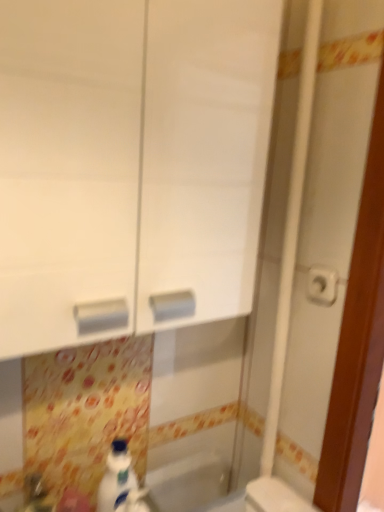
What do you see at coordinates (130, 165) in the screenshot?
I see `white glossy cabinet at center` at bounding box center [130, 165].

Image resolution: width=384 pixels, height=512 pixels. What are the coordinates of `white plastic toilet at lower right` in the screenshot? It's located at (274, 497).

Measure the distance between white glossy bath at lower center and camera.

white glossy bath at lower center is 3.30 feet away from camera.

Describe the element at coordinates (34, 496) in the screenshot. I see `white glossy sink at lower left` at that location.

What do you see at coordinates (322, 285) in the screenshot? I see `white plastic toilet paper at right` at bounding box center [322, 285].

What do you see at coordinates (116, 477) in the screenshot? I see `white glossy bottle at lower center` at bounding box center [116, 477].

This screenshot has width=384, height=512. In order to click on white glossy cabinet at center in this screenshot , I will do `click(130, 165)`.

Does white plastic toilet at lower right touch white glossy bottle at lower center?

No, white plastic toilet at lower right is not beside white glossy bottle at lower center.

Between white plastic toilet at lower right and white glossy bottle at lower center, which one has larger size?

white plastic toilet at lower right.

From their relative heights in the image, would you say white plastic toilet at lower right is taller or shorter than white glossy bottle at lower center?

Considering their sizes, white plastic toilet at lower right has less height than white glossy bottle at lower center.

Looking at this image, would you say white glossy cabinet at center is to the left or to the right of white plastic toilet at lower right in the picture?

Based on their positions, white glossy cabinet at center is located to the left of white plastic toilet at lower right.

From a real-world perspective, is white glossy cabinet at center located beneath white plastic toilet at lower right?

No, from a real-world perspective, white glossy cabinet at center is not under white plastic toilet at lower right.

Consider the image. Between white glossy cabinet at center and white plastic toilet at lower right, which one has larger width?

With larger width is white glossy cabinet at center.

From a real-world perspective, is white glossy sink at lower left positioned above or below white plastic toilet paper at right?

In terms of real-world spatial position, white glossy sink at lower left is below white plastic toilet paper at right.

Which of these two, white glossy sink at lower left or white plastic toilet paper at right, is bigger?

white glossy sink at lower left.

Between point (29, 484) and point (333, 295), which one is positioned in front?

The point (333, 295) is closer.

Does white glossy sink at lower left have a greater height compared to white plastic toilet paper at right?

Yes.

Which is more to the left, white plastic toilet at lower right or white glossy cabinet at center?

white glossy cabinet at center.

How many degrees apart are the facing directions of white plastic toilet at lower right and white glossy cabinet at center?

The angle between the facing direction of white plastic toilet at lower right and the facing direction of white glossy cabinet at center is 87.8 degrees.

Locate an element on the screen. The image size is (384, 512). toilet to the right of white glossy cabinet at center is located at coordinates (274, 497).

From the image's perspective, who appears lower, white plastic toilet paper at right or white glossy bottle at lower center?

white glossy bottle at lower center is shown below in the image.

Which is in front, point (310, 297) or point (110, 495)?

The point (110, 495) is closer.

Considering the positions of objects white plastic toilet paper at right and white glossy bottle at lower center in the image provided, who is more to the right, white plastic toilet paper at right or white glossy bottle at lower center?

white plastic toilet paper at right.

Would you say white plastic toilet paper at right contains white glossy bottle at lower center?

No, white glossy bottle at lower center is located outside of white plastic toilet paper at right.

Can you confirm if white glossy sink at lower left is shorter than white plastic toilet at lower right?

Correct, white glossy sink at lower left is not as tall as white plastic toilet at lower right.

In the image, there is a white glossy sink at lower left. Identify the location of toilet below it (from the image's perspective). Image resolution: width=384 pixels, height=512 pixels. (274, 497).

Is white glossy sink at lower left not near white plastic toilet at lower right?

No, white glossy sink at lower left is in close proximity to white plastic toilet at lower right.

Considering the points (332, 284) and (228, 472), which point is behind, point (332, 284) or point (228, 472)?

The point (228, 472) is behind.

Is white plastic toilet paper at right completely or partially outside of white glossy bath at lower center?

Absolutely, white plastic toilet paper at right is external to white glossy bath at lower center.

How many degrees apart are the facing directions of white plastic toilet paper at right and white glossy bath at lower center?

92.2 degrees.

Locate an element on the screen. The image size is (384, 512). toilet that is on the right side of white glossy bottle at lower center is located at coordinates (274, 497).

The height and width of the screenshot is (512, 384). I want to click on toilet that appears below the white glossy cabinet at center (from the image's perspective), so click(274, 497).

Based on their spatial positions, is white glossy sink at lower left or white plastic toilet paper at right further from white glossy bath at lower center?

white plastic toilet paper at right lies further to white glossy bath at lower center than the other object.

From the image, which object appears to be nearer to white glossy sink at lower left, white glossy bottle at lower center or white plastic toilet paper at right?

white glossy bottle at lower center lies closer to white glossy sink at lower left than the other object.

From the image, which object appears to be farther from white glossy sink at lower left, white plastic toilet at lower right or white glossy cabinet at center?

white glossy cabinet at center.

Estimate the real-world distances between objects in this image. Which object is closer to white plastic toilet paper at right, white glossy sink at lower left or white glossy bottle at lower center?

The object closer to white plastic toilet paper at right is white glossy bottle at lower center.

Based on their spatial positions, is white glossy sink at lower left or white plastic toilet at lower right closer to white glossy bath at lower center?

The object closer to white glossy bath at lower center is white plastic toilet at lower right.

In the scene shown: Which object lies further to the anchor point white plastic toilet at lower right, white plastic toilet paper at right or white glossy sink at lower left?

Among the two, white glossy sink at lower left is located further to white plastic toilet at lower right.

Which object lies further to the anchor point white plastic toilet paper at right, white glossy bath at lower center or white plastic toilet at lower right?

The object further to white plastic toilet paper at right is white glossy bath at lower center.

Based on the photo, which object lies nearer to the anchor point white glossy bottle at lower center, white plastic toilet at lower right or white plastic toilet paper at right?

white plastic toilet at lower right lies closer to white glossy bottle at lower center than the other object.

The width and height of the screenshot is (384, 512). I want to click on cleaning product between white plastic toilet paper at right and white glossy bath at lower center in the up-down direction, so click(x=116, y=477).

Identify the location of bath located between white glossy sink at lower left and white plastic toilet at lower right in the left-right direction. (191, 483).

Find the location of a particular element. cleaning product between white glossy sink at lower left and white glossy bath at lower center is located at coordinates (116, 477).

Identify the location of toilet paper between white glossy cabinet at center and white plastic toilet at lower right from top to bottom. The width and height of the screenshot is (384, 512). (322, 285).